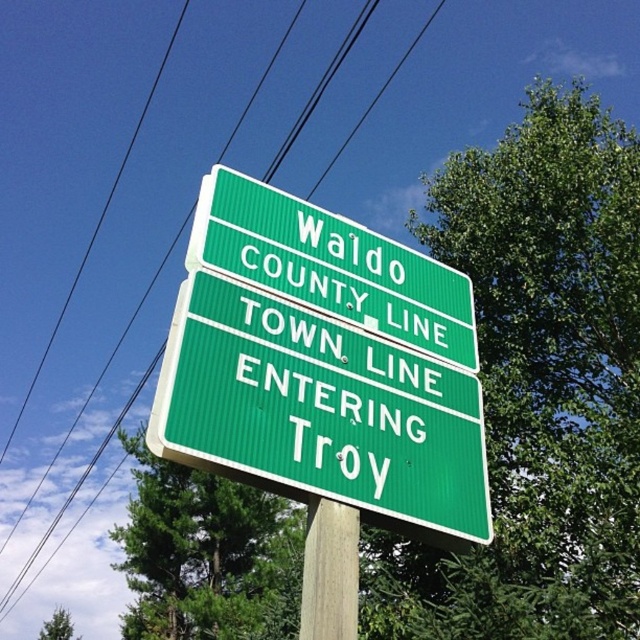
Who is shorter, green leafy tree at center or black wire at upper center?

With less height is green leafy tree at center.

Which is below, green leafy tree at center or black wire at upper center?

green leafy tree at center

Which is in front, point (291, 516) or point (131, 401)?

Point (291, 516) is in front.

Where is `green leafy tree at center`? green leafy tree at center is located at coordinates (205, 556).

Which of these two, green leafy tree at center or wooden post at center, stands taller?

green leafy tree at center is taller.

Consider the image. Is green leafy tree at center to the left of wooden post at center from the viewer's perspective?

Indeed, green leafy tree at center is positioned on the left side of wooden post at center.

Which is behind, point (264, 611) or point (349, 584)?

The point (264, 611) is more distant.

Where is `green leafy tree at center`? green leafy tree at center is located at coordinates (205, 556).

Who is lower down, green leafy tree at center or green leafy tree at lower left?

green leafy tree at lower left is below.

Between point (216, 516) and point (51, 630), which one is positioned behind?

The point (51, 630) is more distant.

The width and height of the screenshot is (640, 640). I want to click on green leafy tree at center, so click(205, 556).